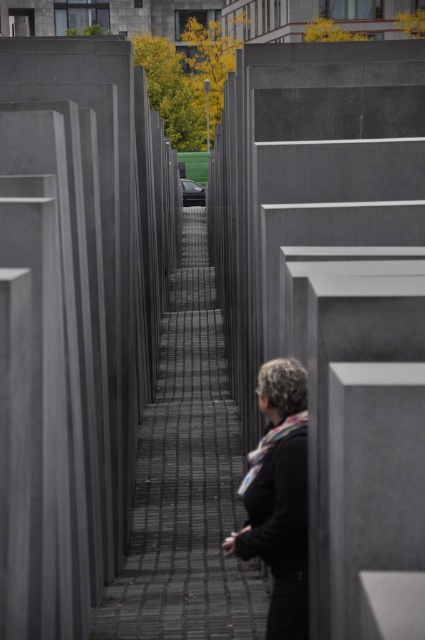
You are standing at the entrance of the memorial and notice a person wearing a black matte jacket at center and gray concrete at center. Which object is located to the left of the other?

The gray concrete at center is positioned on the left side of black matte jacket at center, so the gray concrete at center is to the left of the black matte jacket at center.

You are standing at the entrance of the Memorial to the Murdered Jews of Europe. You see a gray concrete at center and a black matte jacket at center. Which object is positioned lower in the scene?

The gray concrete at center is located below the black matte jacket at center, so it is positioned lower in the scene.